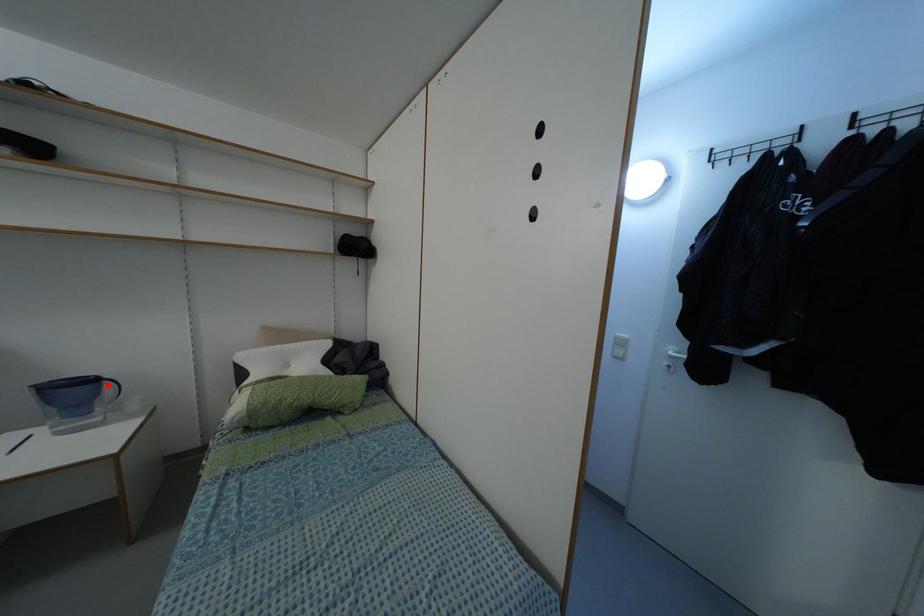
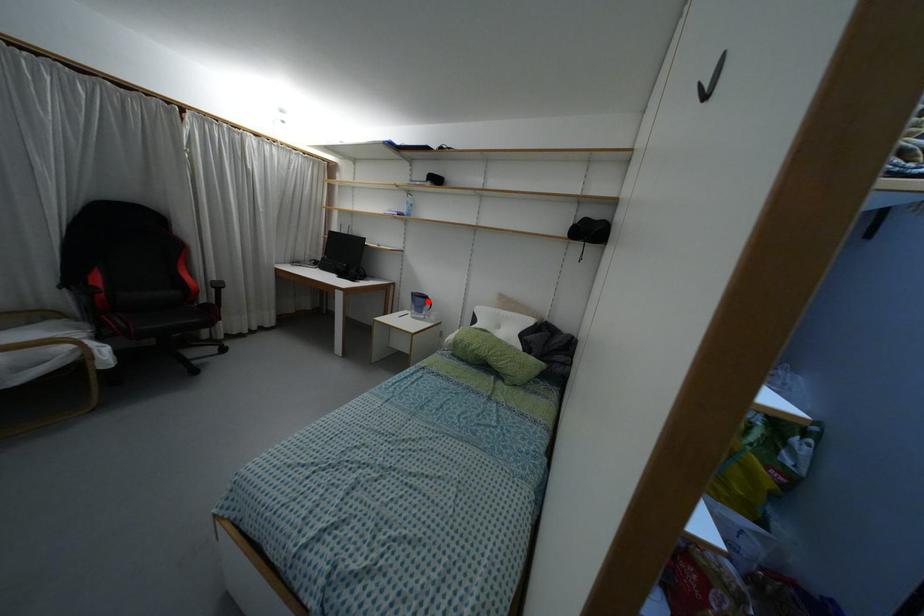
I am providing you with two images of the same scene from different viewpoints. A red point is marked on the first image and another point is marked on the second image. Is the marked point in image1 the same physical position as the marked point in image2?

Yes